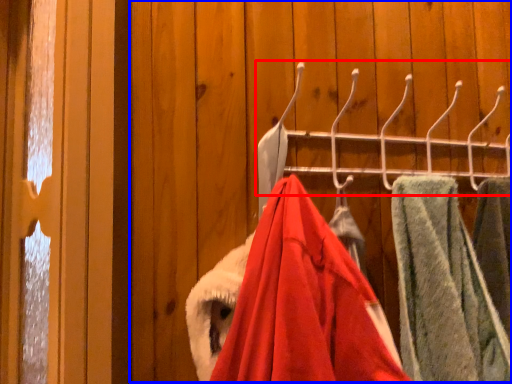
Question: Which object appears closest to the camera in this image, closet (highlighted by a red box) or closet (highlighted by a blue box)?

Choices:
 (A) closet
 (B) closet

Answer: (B)